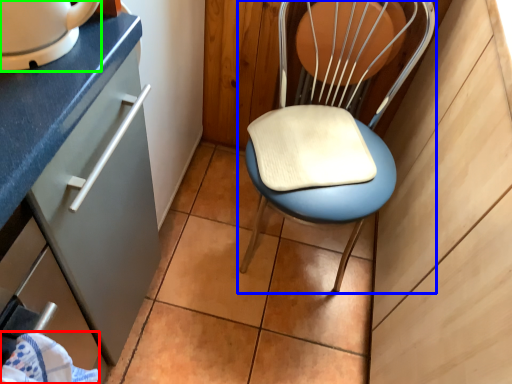
Question: Estimate the real-world distances between objects in this image. Which object is closer to material (highlighted by a red box), chair (highlighted by a blue box) or home appliance (highlighted by a green box)?

Choices:
 (A) chair
 (B) home appliance

Answer: (B)